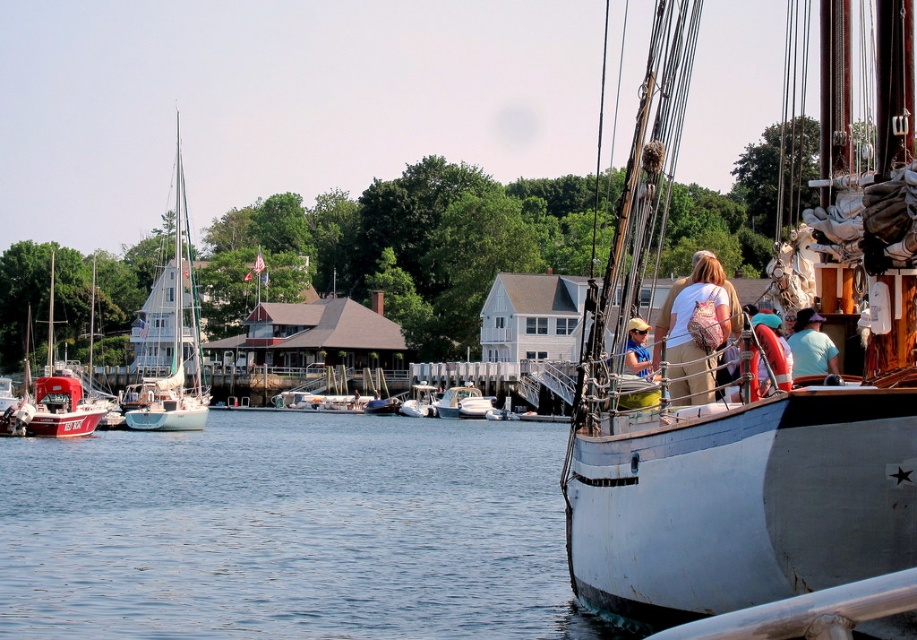
How distant is white matte sailboat at center from clear water at lower left?

A distance of 30.27 meters exists between white matte sailboat at center and clear water at lower left.

Is point (593, 490) farther from camera compared to point (435, 545)?

No, (593, 490) is closer to viewer.

Where is `white matte sailboat at center`? The width and height of the screenshot is (917, 640). white matte sailboat at center is located at coordinates (750, 378).

Does white glossy sailboat at left appear under light blue fabric at center?

Incorrect, white glossy sailboat at left is not positioned below light blue fabric at center.

Does point (172, 394) come farther from viewer compared to point (816, 344)?

Yes, point (172, 394) is behind point (816, 344).

Is point (182, 372) positioned behind point (832, 349)?

Yes.

At what (x,y) coordinates should I click in order to perform the action: click on white glossy sailboat at left. Please return your answer as a coordinate pair (x, y). Looking at the image, I should click on (168, 337).

From the picture: Does white matte sailboat at center lie in front of white glossy motorboat at center?

Yes, it is.

You are a GUI agent. You are given a task and a screenshot of the screen. Output one action in this format:
    pyautogui.click(x=<x>, y=<y>)
    Task: Click on the white matte sailboat at center
    This screenshot has width=917, height=640.
    Given the screenshot: What is the action you would take?
    pyautogui.click(x=750, y=378)